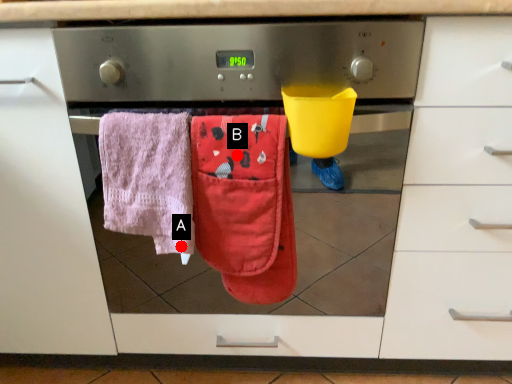
Question: Two points are circled on the image, labeled by A and B beside each circle. Which of the following is the farthest from the observer?

Choices:
 (A) A is further
 (B) B is further

Answer: (A)